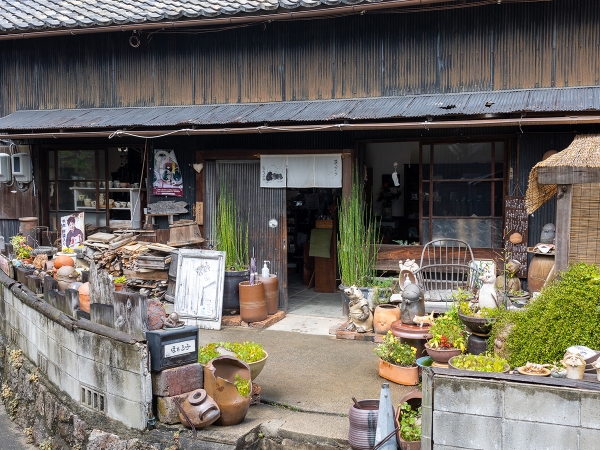
At what (x,y) coordinates should I click in order to perform the action: click on chair. Please return your answer as a coordinate pair (x, y). The width and height of the screenshot is (600, 450). Looking at the image, I should click on (438, 296).